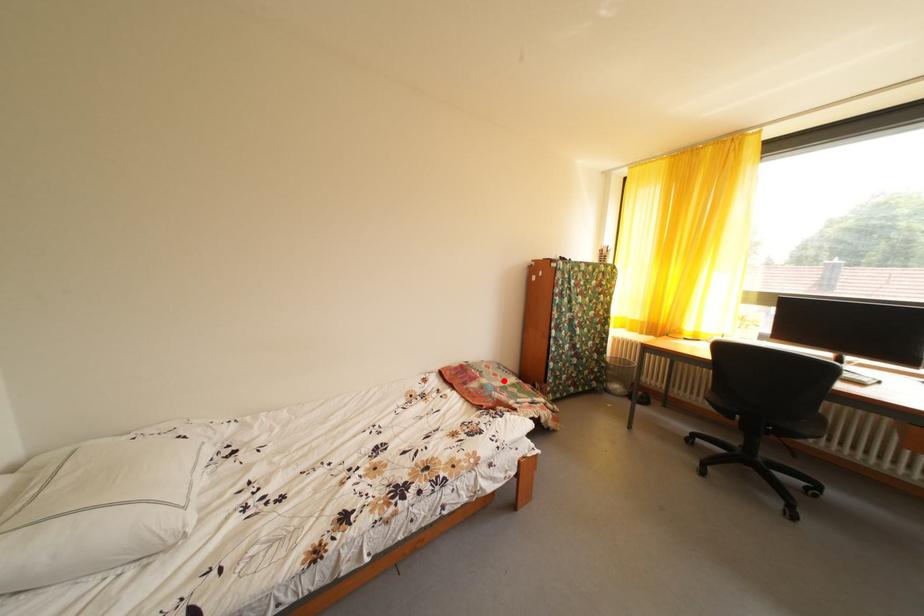
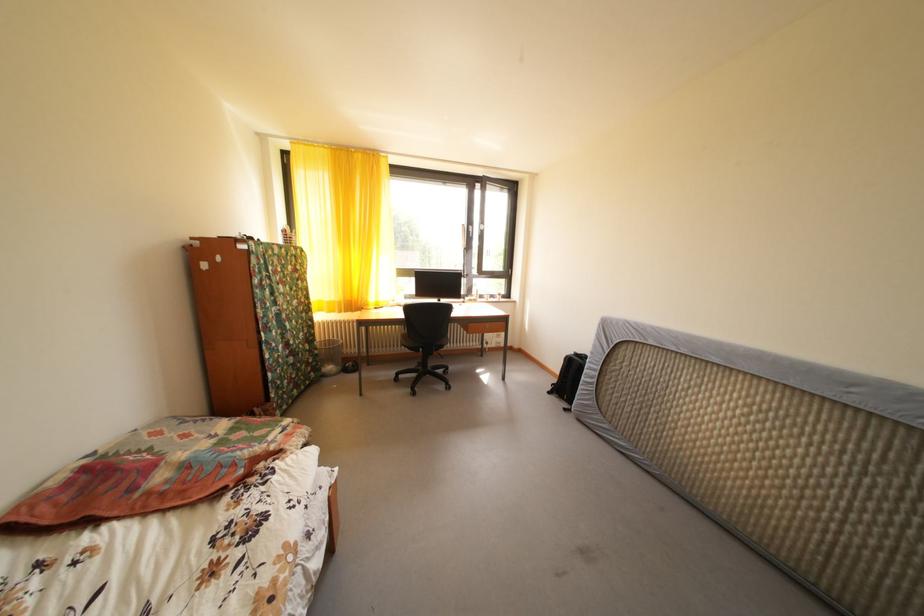
Question: I am providing you with two images of the same scene from different viewpoints. A red point is shown in image1. For the corresponding object point in image2, is it positioned nearer or farther from the camera?

Choices:
 (A) Nearer
 (B) Farther

Answer: (A)